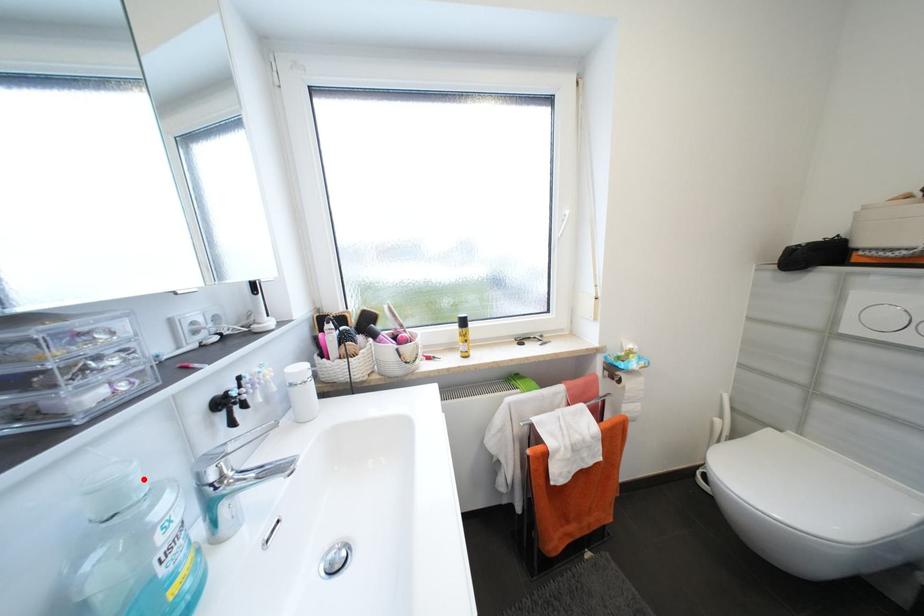
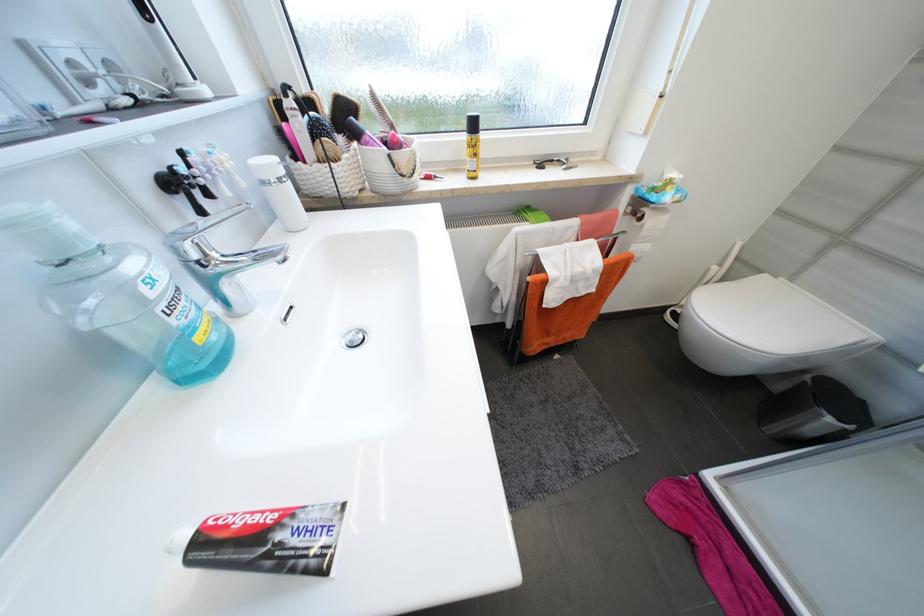
In the second image, find the point that corresponds to the highlighted location in the first image.

(78, 227)